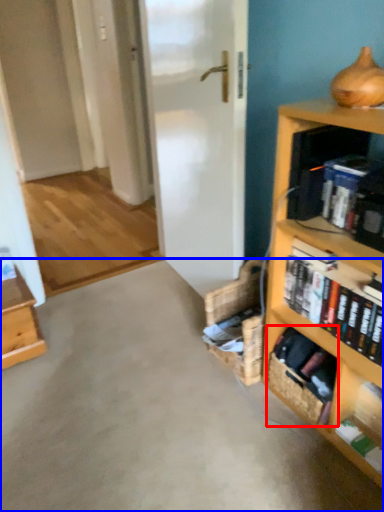
Question: Which object is further to the camera taking this photo, basket (highlighted by a red box) or concrete (highlighted by a blue box)?

Choices:
 (A) basket
 (B) concrete

Answer: (A)